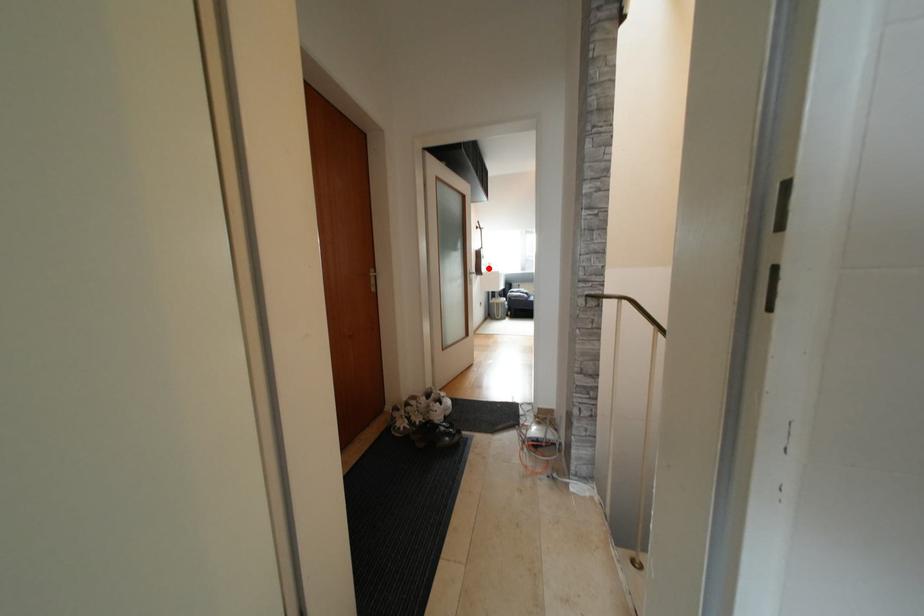
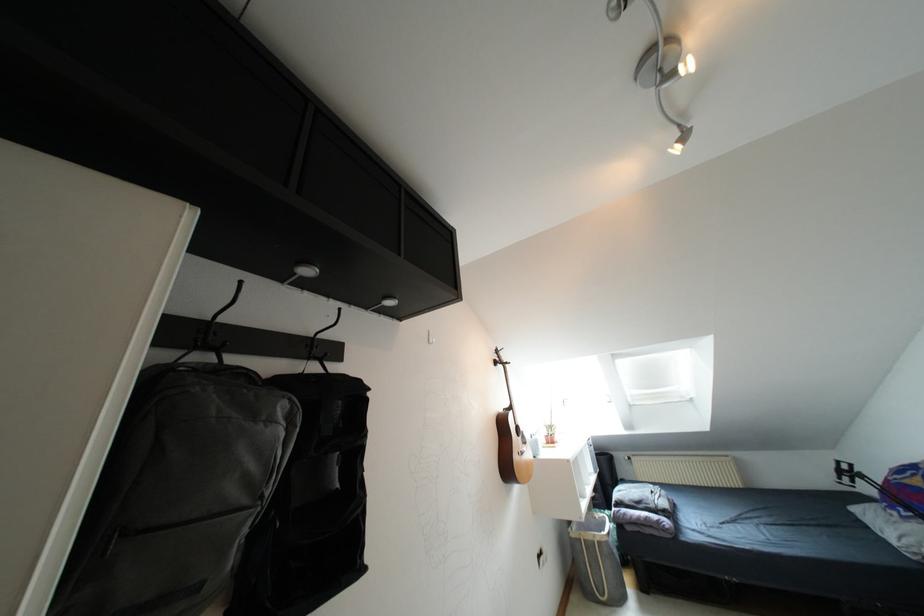
Question: I am providing you with two images of the same scene from different viewpoints. Given a red point in image1, look at the same physical point in image2. Is it:

Choices:
 (A) Closer to the viewpoint
 (B) Farther from the viewpoint

Answer: (B)